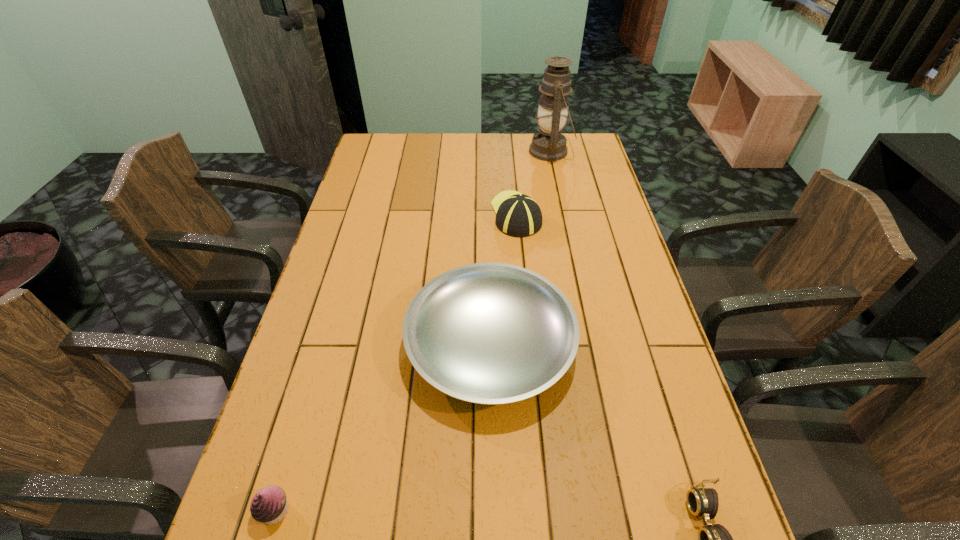
Identify the location of vacant area located 0.080m on the right of the third nearest object. This screenshot has width=960, height=540. (605, 344).

Where is `object at the far edge`? The image size is (960, 540). object at the far edge is located at coordinates (549, 144).

Find the location of `object situated at the left edge`. object situated at the left edge is located at coordinates (269, 505).

Image resolution: width=960 pixels, height=540 pixels. I want to click on object that is positioned at the right edge, so click(x=549, y=144).

This screenshot has height=540, width=960. Find the location of `object present at the far right corner`. object present at the far right corner is located at coordinates (549, 144).

The image size is (960, 540). I want to click on free space at the far edge of the desktop, so click(482, 151).

The image size is (960, 540). I want to click on vacant space at the left edge, so click(360, 306).

Identify the location of vacant space at the right edge. Image resolution: width=960 pixels, height=540 pixels. (576, 207).

In the image, there is a desktop. Where is `vacant region at the far left corner`? The width and height of the screenshot is (960, 540). vacant region at the far left corner is located at coordinates (389, 134).

Identify the location of vacant space in between the third farthest object and the cupcake. (383, 427).